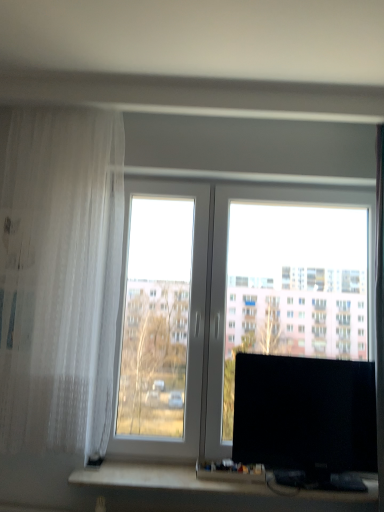
Question: In terms of height, does black plastic computer desk at lower center look taller or shorter compared to transparent glass window at center?

Choices:
 (A) short
 (B) tall

Answer: (A)

Question: Is black plastic computer desk at lower center wider or thinner than transparent glass window at center?

Choices:
 (A) wide
 (B) thin

Answer: (A)

Question: Estimate the real-world distances between objects in this image. Which object is farther from the black plastic computer desk at lower center?

Choices:
 (A) white sheer curtain at left
 (B) black glossy monitor at right
 (C) transparent glass window at center

Answer: (A)

Question: Estimate the real-world distances between objects in this image. Which object is farther from the transparent glass window at center?

Choices:
 (A) black plastic computer desk at lower center
 (B) black glossy monitor at right
 (C) white sheer curtain at left

Answer: (A)